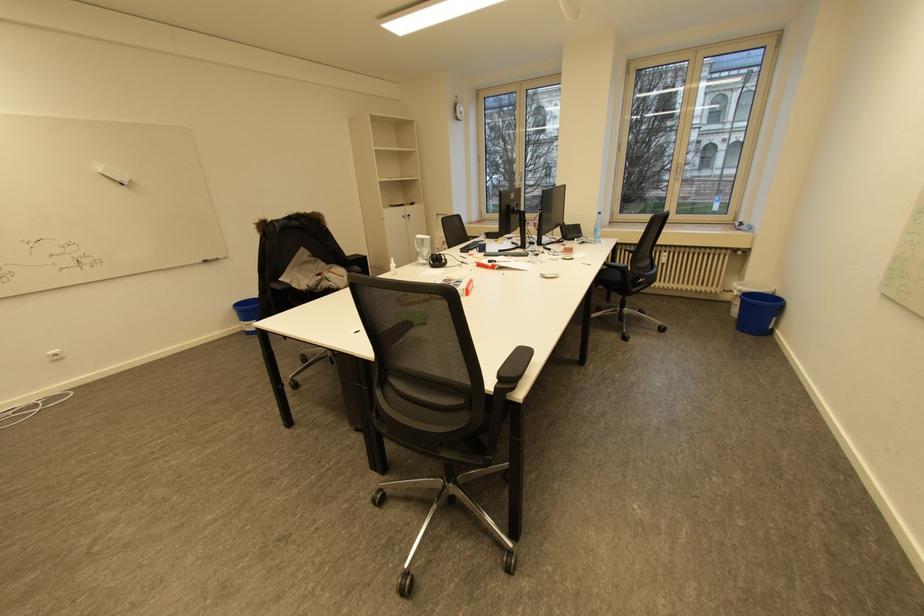
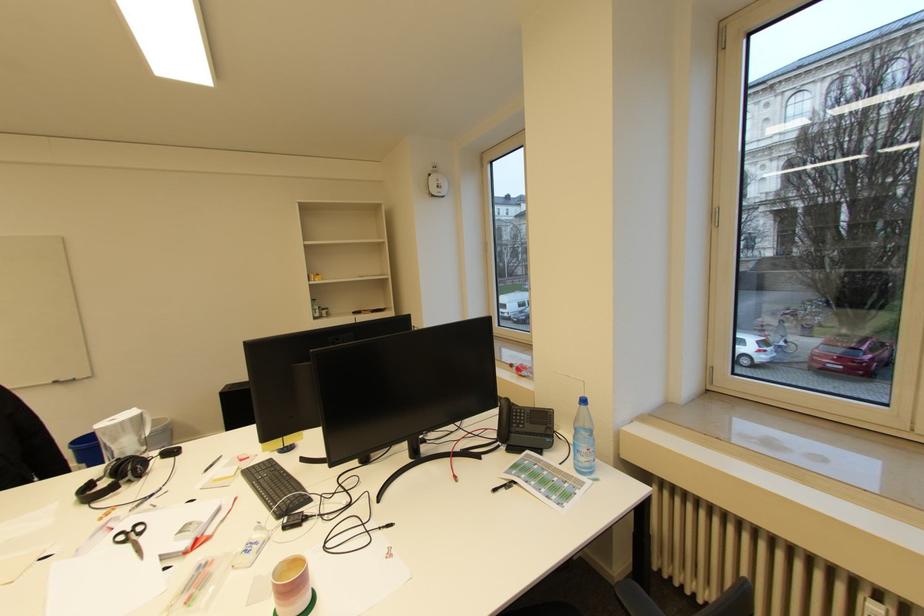
Locate, in the second image, the point that corresponds to point 602,225 in the first image.

(581, 429)